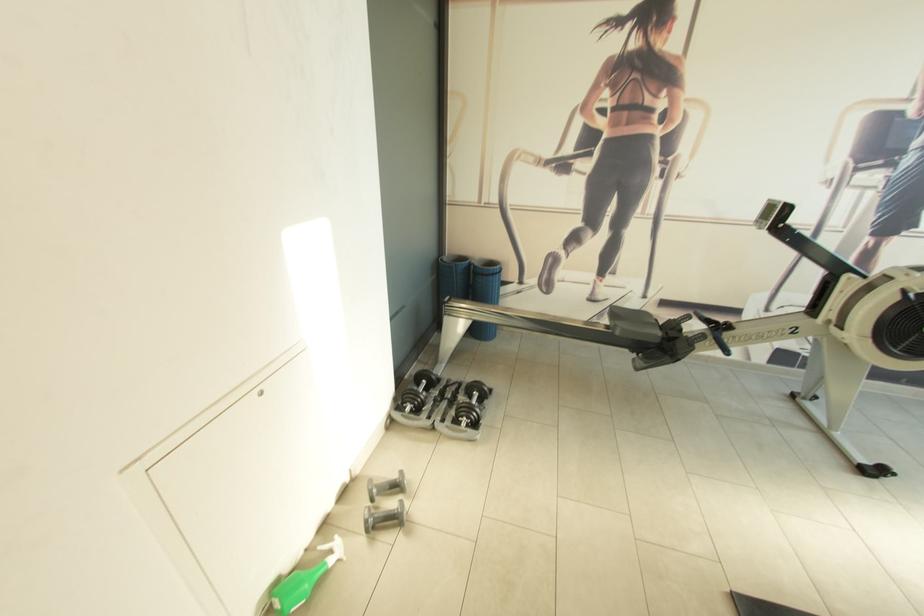
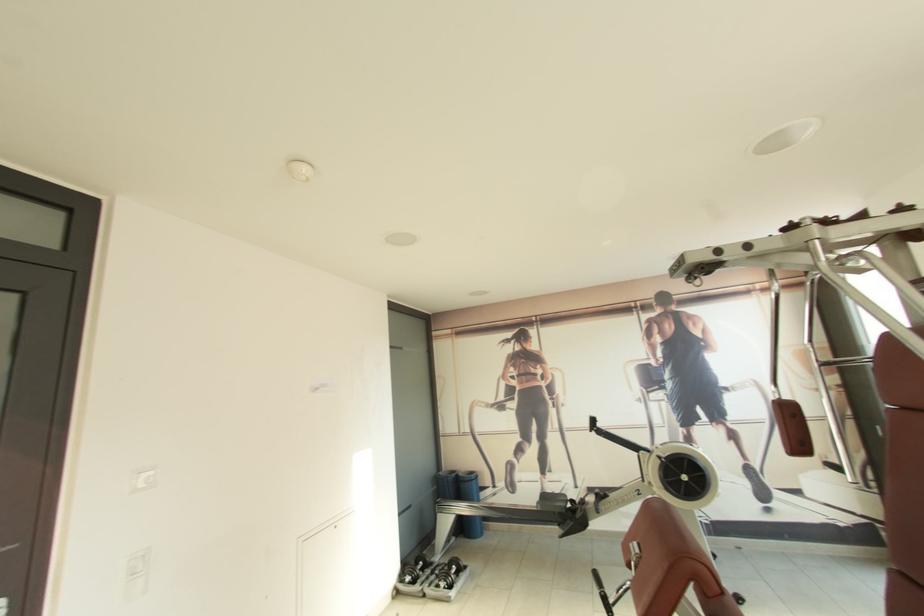
In the second image, find the point that corresponds to pixel 497 265 in the first image.

(476, 475)